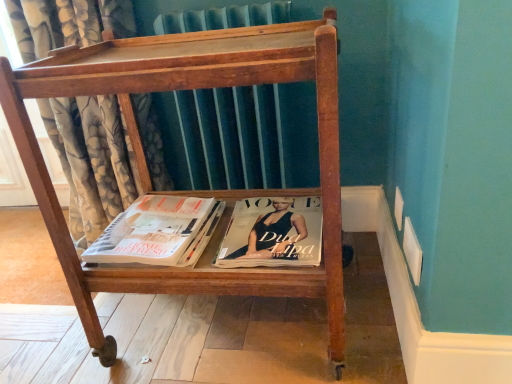
Question: Based on their sizes in the image, would you say wooden magazine rack at center is bigger or smaller than floral fabric curtain at left?

Choices:
 (A) big
 (B) small

Answer: (B)

Question: From a real-world perspective, is wooden magazine rack at center above or below floral fabric curtain at left?

Choices:
 (A) below
 (B) above

Answer: (A)

Question: Considering the real-world distances, which object is closest to the wooden magazine rack at center?

Choices:
 (A) matte white book at center
 (B) matte black magazine at center
 (C) floral fabric curtain at left

Answer: (A)

Question: Which of these objects is positioned farthest from the wooden magazine rack at center?

Choices:
 (A) matte white book at center
 (B) matte black magazine at center
 (C) floral fabric curtain at left

Answer: (C)